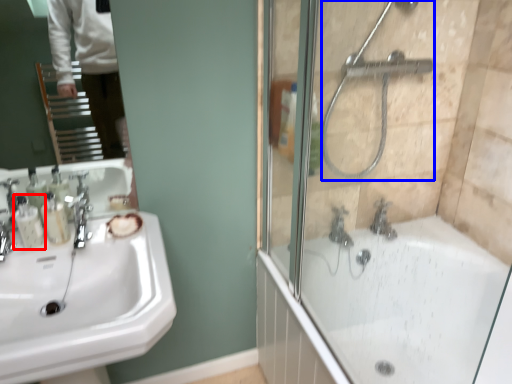
Question: Which point is further to the camera, toiletry (highlighted by a red box) or shower (highlighted by a blue box)?

Choices:
 (A) toiletry
 (B) shower

Answer: (A)